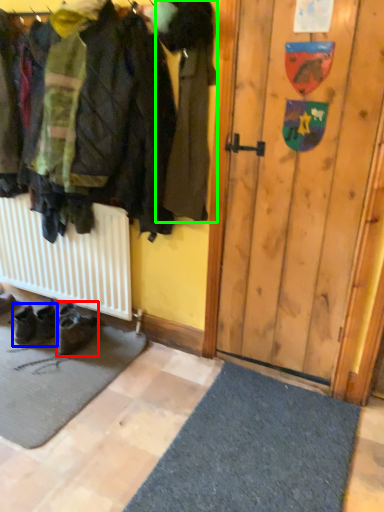
Question: Considering the real-world distances, which object is farthest from footwear (highlighted by a red box)? footwear (highlighted by a blue box) or jacket (highlighted by a green box)?

Choices:
 (A) footwear
 (B) jacket

Answer: (B)